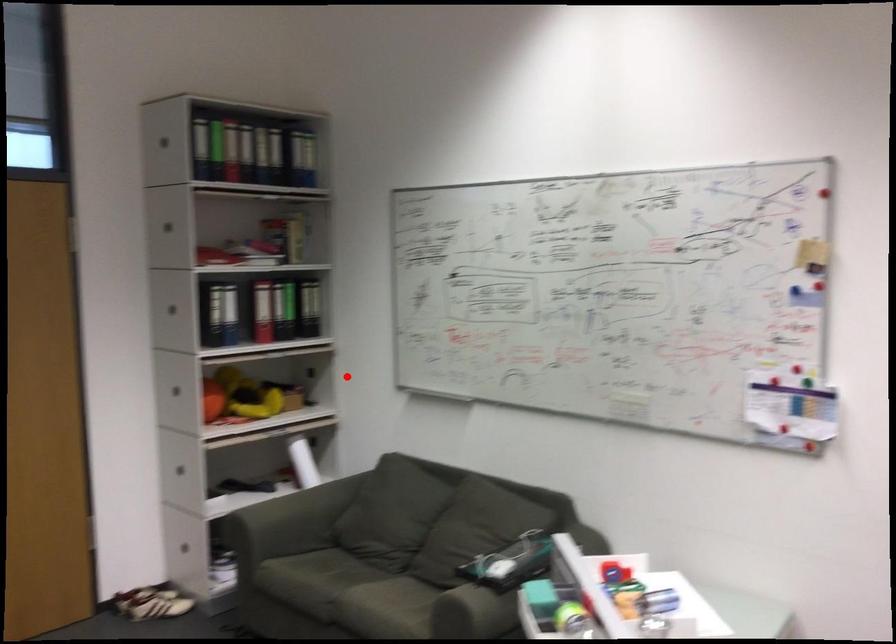
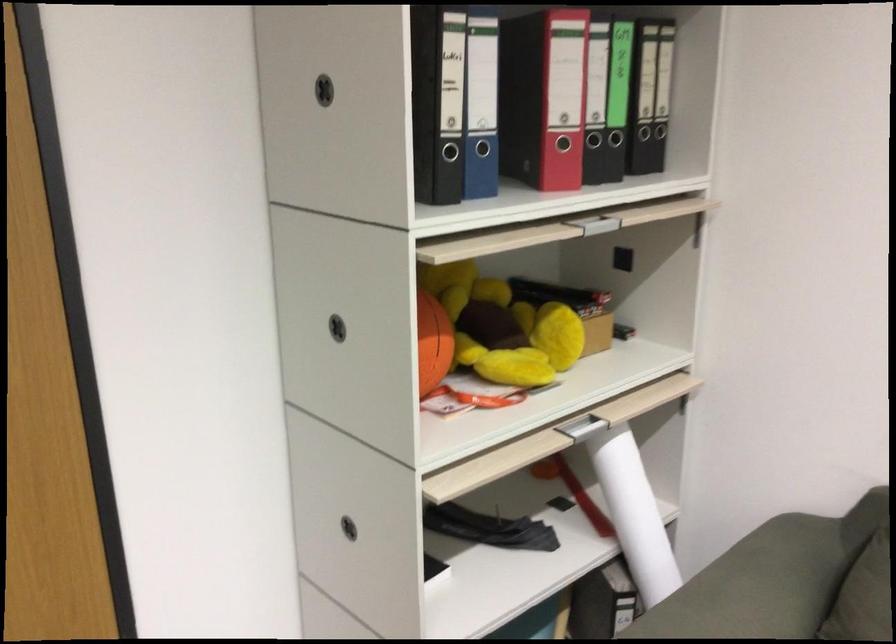
Locate, in the second image, the point that corresponds to the highlighted location in the first image.

(743, 260)